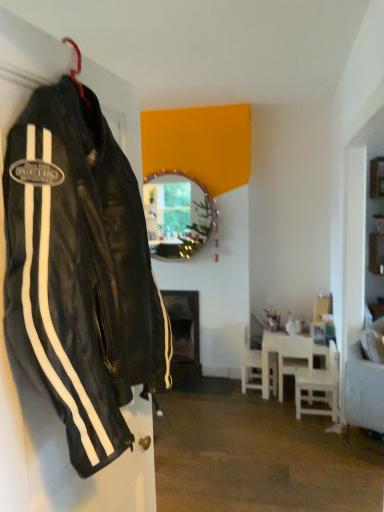
Image resolution: width=384 pixels, height=512 pixels. I want to click on vacant space situated on the left part of white plastic chair at lower right, arranged as the 1th chair when viewed from the back, so click(220, 386).